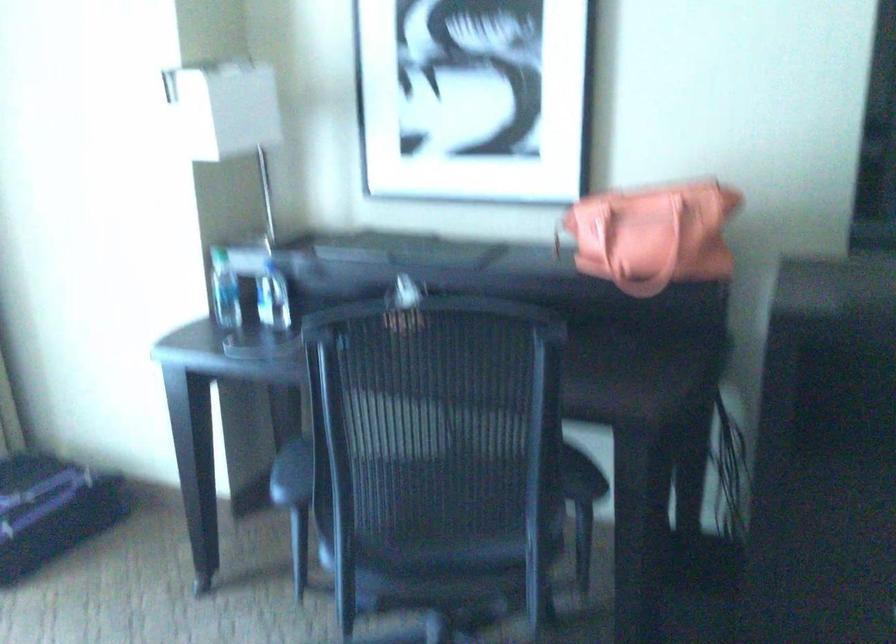
I want to click on chair sitting surface, so click(x=458, y=544).